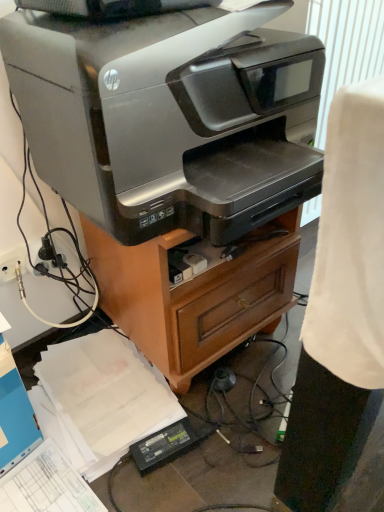
Question: Is point (163, 193) closer or farther from the camera than point (279, 244)?

Choices:
 (A) farther
 (B) closer

Answer: (B)

Question: Visually, is satin silver printer at center positioned to the left or to the right of silver metallic printer at center?

Choices:
 (A) right
 (B) left

Answer: (B)

Question: Which is nearer to the silver metallic printer at center?

Choices:
 (A) black plastic plug at lower left
 (B) satin silver printer at center

Answer: (B)

Question: Estimate the real-world distances between objects in this image. Which object is farther from the satin silver printer at center?

Choices:
 (A) silver metallic printer at center
 (B) black plastic plug at lower left

Answer: (B)